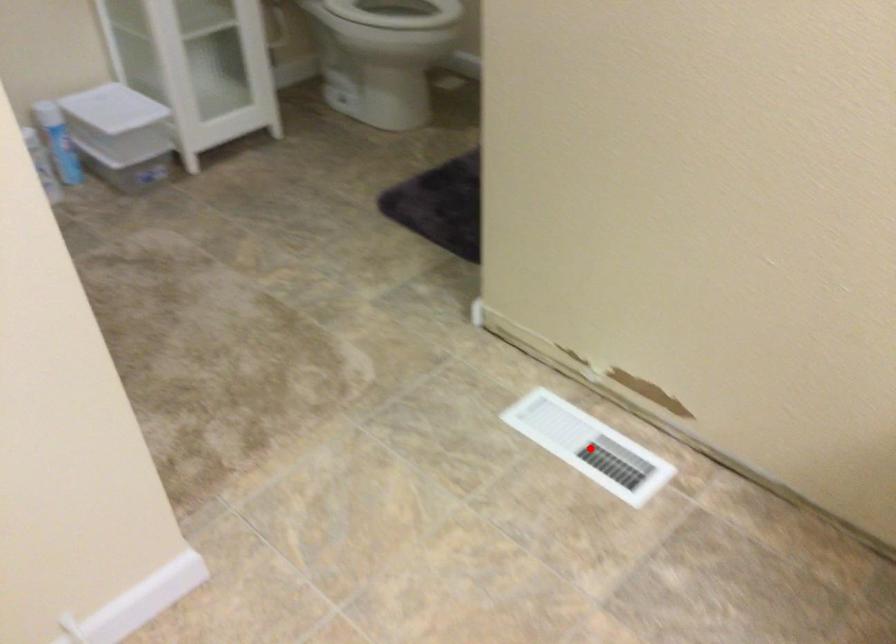
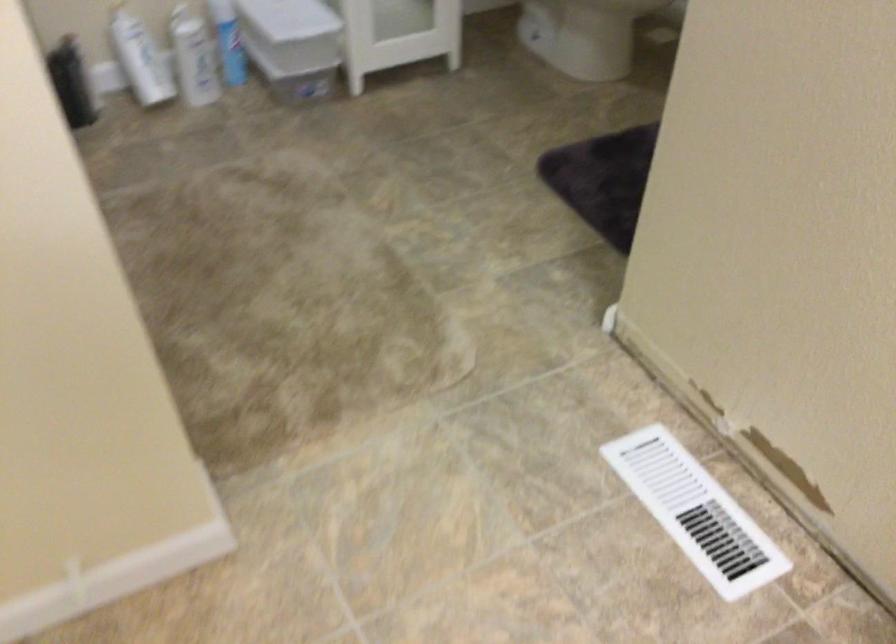
Question: A red point is marked in image1. In image2, is the corresponding 3D point closer to the camera or farther? Reply with the corresponding letter.

Choices:
 (A) The corresponding 3D point is closer.
 (B) The corresponding 3D point is farther.

Answer: (A)